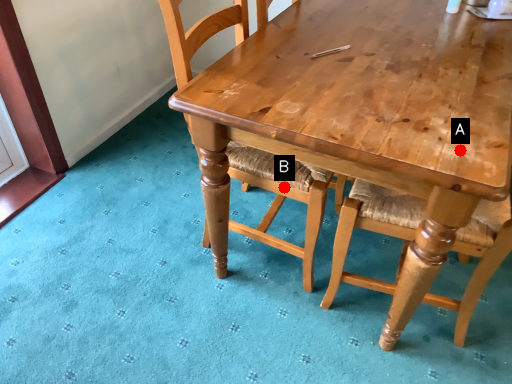
Question: Two points are circled on the image, labeled by A and B beside each circle. Which of the following is the closest to the observer?

Choices:
 (A) A is closer
 (B) B is closer

Answer: (A)